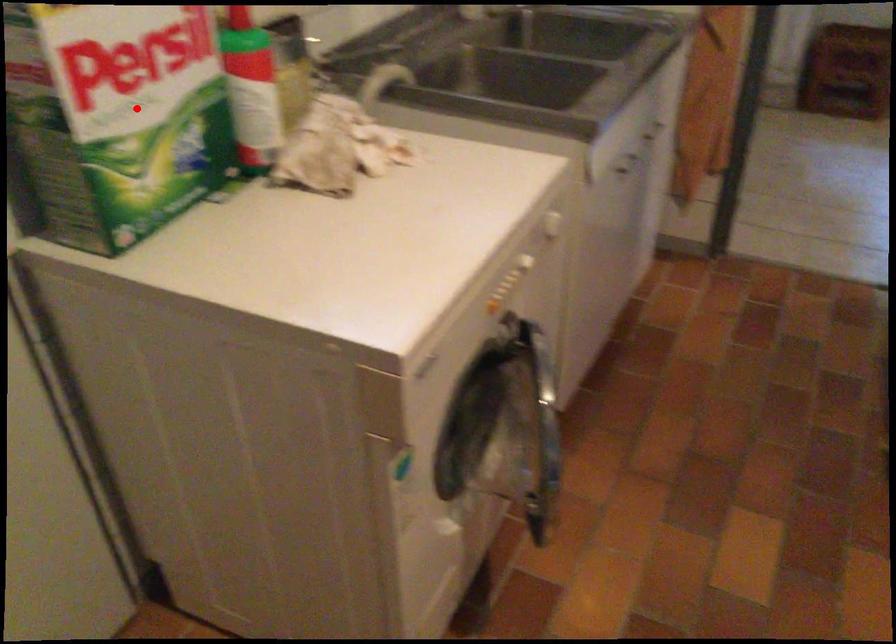
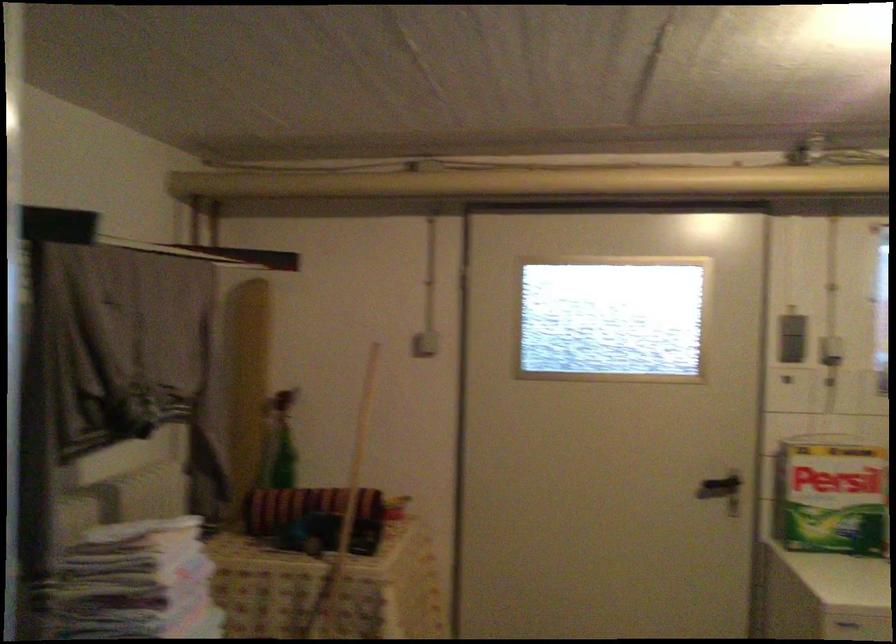
Question: I am providing you with two images of the same scene from different viewpoints. Given a red point in image1, look at the same physical point in image2. Is it:

Choices:
 (A) Closer to the viewpoint
 (B) Farther from the viewpoint

Answer: (B)